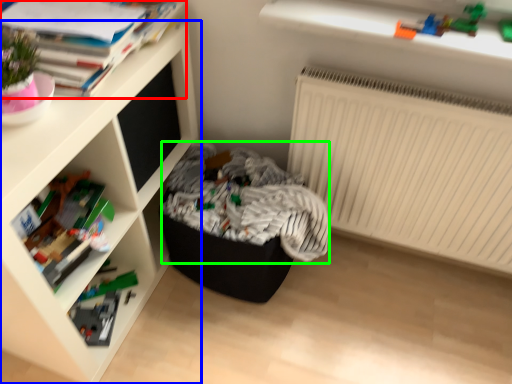
Question: Based on their relative distances, which object is farther from book (highlighted by a red box)? Choose from shelf (highlighted by a blue box) and laundry (highlighted by a green box).

Choices:
 (A) shelf
 (B) laundry

Answer: (B)